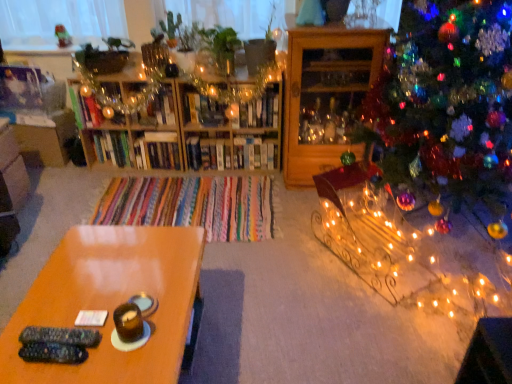
This screenshot has width=512, height=384. What are the coordinates of `vacant space in between wooden cabinet at right, arranged as the first shelf when viewed from the right, and wooden bookshelf at center, the third shelf when ordered from right to left` in the screenshot? It's located at (236, 175).